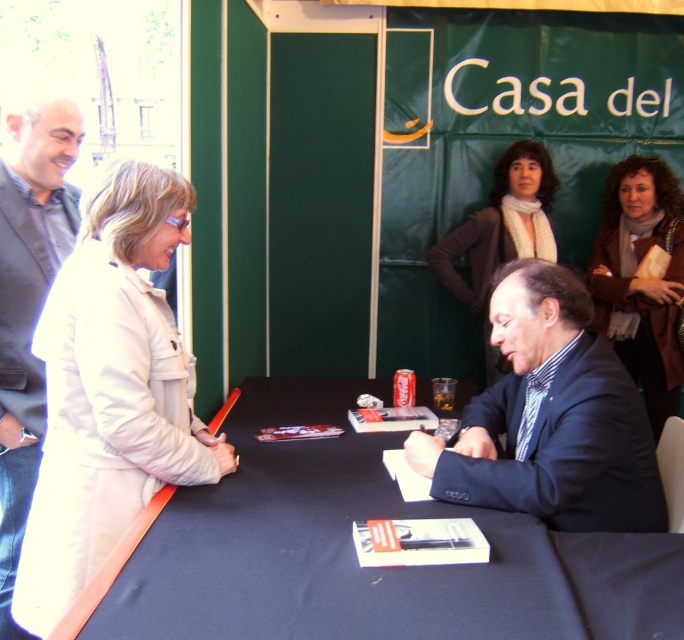
Does dark blue suit at center have a lesser height compared to brown leather jacket at upper center?

Yes.

Is point (551, 496) more distant than point (486, 248)?

No, it is in front of (486, 248).

Who is more distant from viewer, (547, 332) or (513, 188)?

Positioned behind is point (513, 188).

The height and width of the screenshot is (640, 684). Identify the location of dark blue suit at center. (551, 417).

Between dark blue fabric table at center and dark blue shirt at left, which one is positioned higher?

dark blue shirt at left

What do you see at coordinates (352, 552) in the screenshot? Image resolution: width=684 pixels, height=640 pixels. I see `dark blue fabric table at center` at bounding box center [352, 552].

The width and height of the screenshot is (684, 640). Describe the element at coordinates (352, 552) in the screenshot. I see `dark blue fabric table at center` at that location.

Identify the location of dark blue fabric table at center. Image resolution: width=684 pixels, height=640 pixels. (352, 552).

Which is in front, point (276, 525) or point (503, 369)?

Point (276, 525) is more forward.

Is point (129, 632) farther from camera compared to point (447, 262)?

No, it is in front of (447, 262).

Find the location of a particular element. dark blue fabric table at center is located at coordinates (352, 552).

Find the location of a particular element. The height and width of the screenshot is (640, 684). dark blue fabric table at center is located at coordinates 352,552.